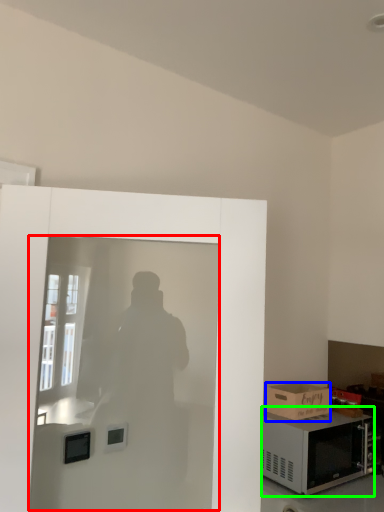
Question: Which object is the closest to the screen door (highlighted by a red box)? Choose among these: box (highlighted by a blue box) or microwave oven (highlighted by a green box).

Choices:
 (A) box
 (B) microwave oven

Answer: (B)